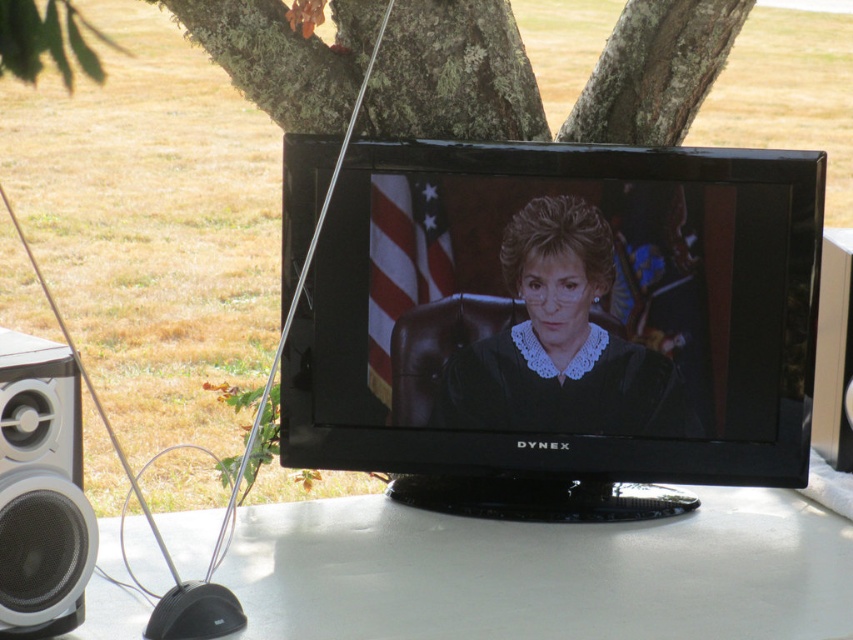
Can you confirm if matte black judge's robe at center is positioned to the right of black plastic speaker at lower left?

In fact, matte black judge's robe at center is to the left of black plastic speaker at lower left.

Who is lower down, matte black judge's robe at center or black plastic speaker at lower left?

matte black judge's robe at center is lower down.

Who is more forward, (630,365) or (851,433)?

Point (630,365) is in front.

Find the location of a particular element. The image size is (853, 640). matte black judge's robe at center is located at coordinates (561, 340).

Based on the photo, can you confirm if white glossy table at center is smaller than matte black judge's robe at center?

No.

Is white glossy table at center shorter than matte black judge's robe at center?

Yes.

Is point (320, 609) positioned before point (610, 428)?

Yes, point (320, 609) is in front of point (610, 428).

Locate an element on the screen. Image resolution: width=853 pixels, height=640 pixels. white glossy table at center is located at coordinates (543, 572).

Is white matte speaker at lower left smaller than black plastic speaker at lower left?

Incorrect, white matte speaker at lower left is not smaller in size than black plastic speaker at lower left.

Between point (7, 560) and point (827, 378), which one is positioned behind?

Point (827, 378)

Which is in front, point (77, 412) or point (828, 326)?

Point (77, 412) is more forward.

You are a GUI agent. You are given a task and a screenshot of the screen. Output one action in this format:
    pyautogui.click(x=<x>, y=<y>)
    Task: Click on the white matte speaker at lower left
    
    Given the screenshot: What is the action you would take?
    pyautogui.click(x=41, y=490)